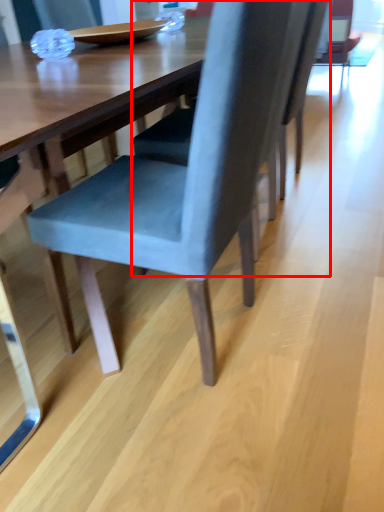
Question: From the image, what is the correct spatial relationship of chair (annotated by the red box) in relation to chair?

Choices:
 (A) left
 (B) right

Answer: (B)